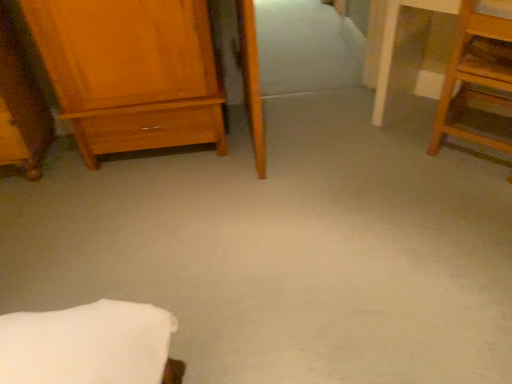
Question: Should I look upward or downward to see wooden step stool at right, which is the 2th furniture from left to right?

Choices:
 (A) down
 (B) up

Answer: (B)

Question: From a real-world perspective, is wooden step stool at right, acting as the first furniture starting from the right, positioned over wooden wardrobe at left, which ranks as the 1th furniture in left-to-right order, based on gravity?

Choices:
 (A) no
 (B) yes

Answer: (A)

Question: Is wooden step stool at right, acting as the first furniture starting from the right, positioned beyond the bounds of wooden wardrobe at left, which ranks as the 1th furniture in left-to-right order?

Choices:
 (A) no
 (B) yes

Answer: (B)

Question: Does wooden step stool at right, acting as the first furniture starting from the right, have a larger size compared to wooden wardrobe at left, which ranks as the 1th furniture in left-to-right order?

Choices:
 (A) no
 (B) yes

Answer: (A)

Question: From a real-world perspective, does wooden step stool at right, acting as the first furniture starting from the right, sit lower than wooden wardrobe at left, the second furniture viewed from the right?

Choices:
 (A) yes
 (B) no

Answer: (A)

Question: Considering the relative positions of wooden step stool at right, acting as the first furniture starting from the right, and wooden wardrobe at left, which ranks as the 1th furniture in left-to-right order, in the image provided, is wooden step stool at right, acting as the first furniture starting from the right, to the right of wooden wardrobe at left, which ranks as the 1th furniture in left-to-right order, from the viewer's perspective?

Choices:
 (A) no
 (B) yes

Answer: (B)

Question: Is the surface of wooden step stool at right, which is the 2th furniture from left to right, in direct contact with wooden wardrobe at left, the second furniture viewed from the right?

Choices:
 (A) yes
 (B) no

Answer: (B)

Question: Does matte wood chest of drawers at left lie in front of wooden wardrobe at left, which ranks as the 1th furniture in left-to-right order?

Choices:
 (A) no
 (B) yes

Answer: (A)

Question: Is matte wood chest of drawers at left taller than wooden wardrobe at left, which ranks as the 1th furniture in left-to-right order?

Choices:
 (A) no
 (B) yes

Answer: (B)

Question: Is matte wood chest of drawers at left smaller than wooden wardrobe at left, which ranks as the 1th furniture in left-to-right order?

Choices:
 (A) yes
 (B) no

Answer: (B)

Question: Would you say matte wood chest of drawers at left is outside wooden wardrobe at left, which ranks as the 1th furniture in left-to-right order?

Choices:
 (A) no
 (B) yes

Answer: (B)

Question: Are matte wood chest of drawers at left and wooden wardrobe at left, which ranks as the 1th furniture in left-to-right order, far apart?

Choices:
 (A) yes
 (B) no

Answer: (B)

Question: Could you tell me if matte wood chest of drawers at left is turned towards wooden wardrobe at left, the second furniture viewed from the right?

Choices:
 (A) yes
 (B) no

Answer: (B)

Question: Is wooden wardrobe at left, which ranks as the 1th furniture in left-to-right order, closer to the viewer compared to wooden step stool at right, acting as the first furniture starting from the right?

Choices:
 (A) yes
 (B) no

Answer: (B)